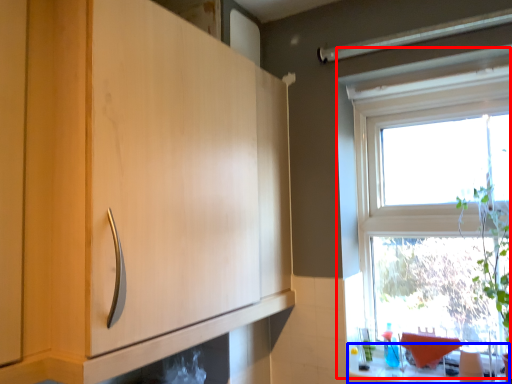
Question: Which of the following is the farthest to the observer, window (highlighted by a red box) or counter top (highlighted by a blue box)?

Choices:
 (A) window
 (B) counter top

Answer: (A)